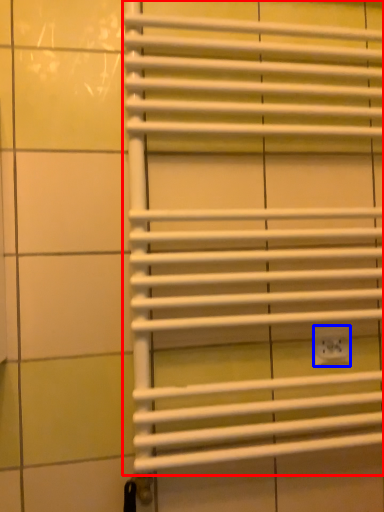
Question: Among these objects, which one is farthest to the camera, window blind (highlighted by a red box) or electric outlet (highlighted by a blue box)?

Choices:
 (A) window blind
 (B) electric outlet

Answer: (B)